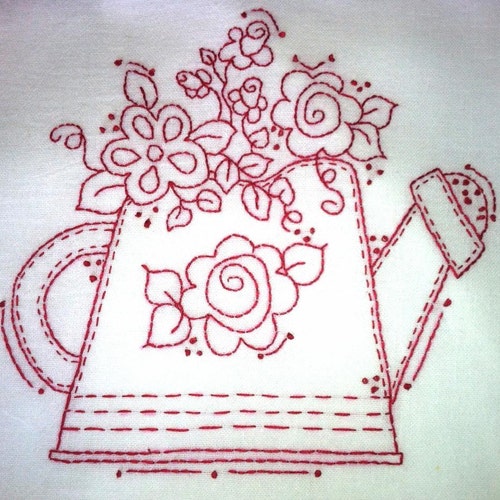
Locate an element on the screen. embroidery is located at coordinates (390, 393), (143, 468), (14, 283), (196, 149).